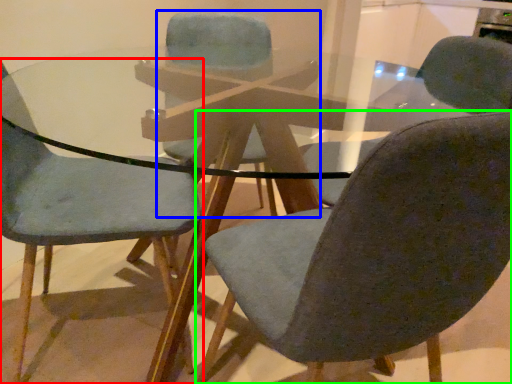
Question: Which object is the farthest from chair (highlighted by a red box)? Choose among these: chair (highlighted by a blue box) or chair (highlighted by a green box).

Choices:
 (A) chair
 (B) chair

Answer: (A)